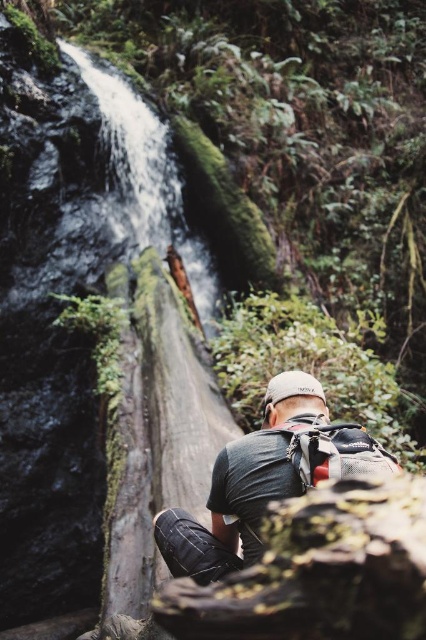
You are standing at the point marked as point (189, 468) in the image. The waterfall is in front of you. If you turn 90 degrees to your right, will you be facing the hiker or away from them?

The hiker is facing the waterfall, so if you turn 90 degrees to your right from point (189, 468), you would be facing away from the hiker.

You are a hiker trying to take a photo of the green mossy tree trunk at center and the dark gray fabric backpack at center. Which object should you focus on first if you want to capture both in the frame without moving the camera?

You should focus on the green mossy tree trunk at center first because it is larger in size than the dark gray fabric backpack at center, so it will require more attention to ensure it fits properly in the frame.